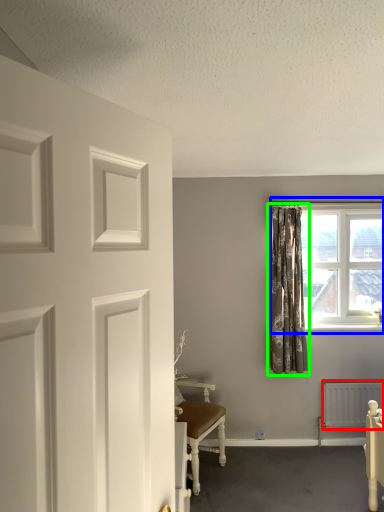
Question: Considering the real-world distances, which object is closest to radiator (highlighted by a red box)? window (highlighted by a blue box) or curtain (highlighted by a green box).

Choices:
 (A) window
 (B) curtain

Answer: (B)